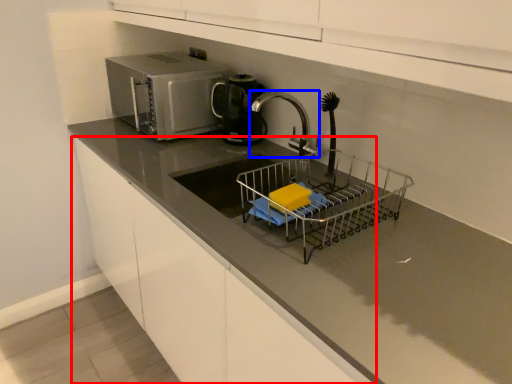
Question: Which object is further to the camera taking this photo, cabinetry (highlighted by a red box) or tap (highlighted by a blue box)?

Choices:
 (A) cabinetry
 (B) tap

Answer: (B)